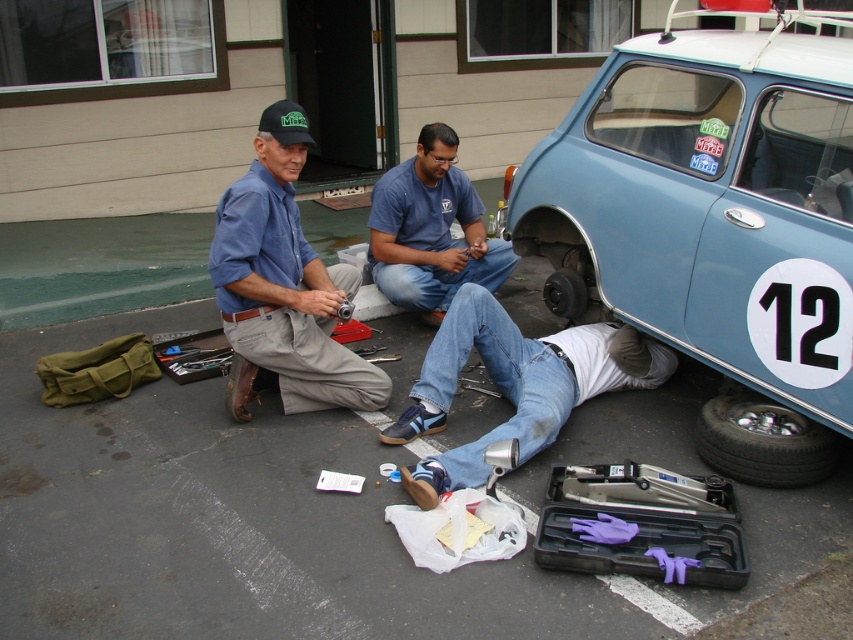
Is black rubber tire at lower right wider than black rubber tire at lower center?

Indeed, black rubber tire at lower right has a greater width compared to black rubber tire at lower center.

Does black rubber tire at lower right appear under black rubber tire at lower center?

Yes.

Which is in front, point (766, 428) or point (566, 298)?

Point (766, 428)

Locate an element on the screen. black rubber tire at lower right is located at coordinates (763, 442).

Image resolution: width=853 pixels, height=640 pixels. What are the coordinates of `blue denim shirt at center` in the screenshot? It's located at (285, 280).

Is point (294, 166) farther from camera compared to point (410, 177)?

No, it is not.

Which is in front, point (299, 374) or point (445, 257)?

Positioned in front is point (299, 374).

Where is `blue denim shirt at center`? blue denim shirt at center is located at coordinates (285, 280).

Is light blue metallic car at lower right positioned before blue denim jeans at center?

That is True.

Describe the element at coordinates (717, 221) in the screenshot. I see `light blue metallic car at lower right` at that location.

The height and width of the screenshot is (640, 853). What do you see at coordinates (717, 221) in the screenshot?
I see `light blue metallic car at lower right` at bounding box center [717, 221].

Locate an element on the screen. light blue metallic car at lower right is located at coordinates click(717, 221).